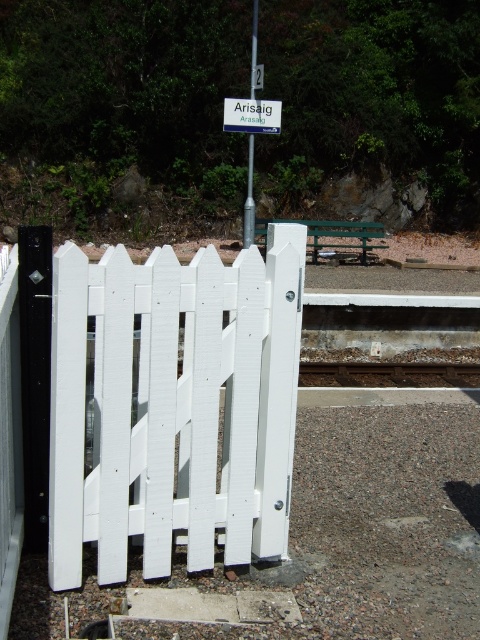
Which is more to the right, white painted wood gate at center or metallic pole at center?

Positioned to the right is white painted wood gate at center.

Can you confirm if white painted wood gate at center is positioned to the right of metallic pole at center?

Yes, white painted wood gate at center is to the right of metallic pole at center.

Identify the location of white painted wood gate at center. The image size is (480, 640). (175, 406).

The width and height of the screenshot is (480, 640). Find the location of `white painted wood gate at center`. white painted wood gate at center is located at coordinates (175, 406).

Which is below, brown gravel train track at center or metallic pole at center?

brown gravel train track at center is lower down.

From the picture: Does brown gravel train track at center have a larger size compared to metallic pole at center?

No.

The width and height of the screenshot is (480, 640). I want to click on brown gravel train track at center, so click(387, 372).

Can you confirm if white painted wood gate at center is positioned to the left of brown gravel train track at center?

Yes, white painted wood gate at center is to the left of brown gravel train track at center.

Who is positioned more to the right, white painted wood gate at center or brown gravel train track at center?

Positioned to the right is brown gravel train track at center.

The width and height of the screenshot is (480, 640). In order to click on white painted wood gate at center in this screenshot , I will do `click(175, 406)`.

The width and height of the screenshot is (480, 640). I want to click on white painted wood gate at center, so click(175, 406).